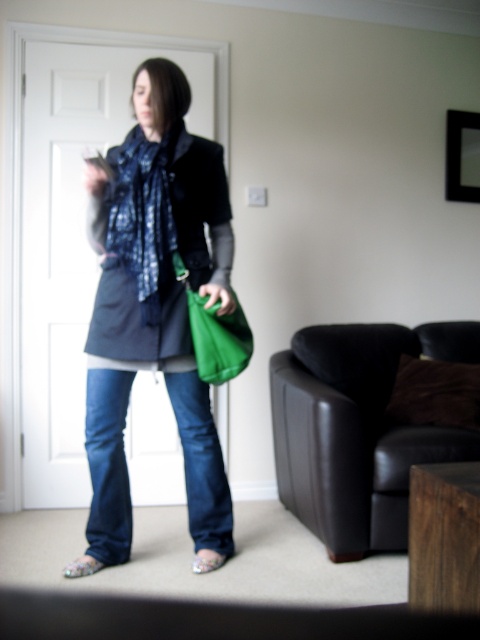
Is green leather bag at lower center positioned in front of floral fabric sandal at lower left?

Yes, green leather bag at lower center is in front of floral fabric sandal at lower left.

The image size is (480, 640). What are the coordinates of `green leather bag at lower center` in the screenshot? It's located at (216, 333).

Does matte black jacket at center appear under green leather bag at lower center?

Result: Indeed, matte black jacket at center is positioned under green leather bag at lower center.

From the picture: Does matte black jacket at center appear on the left side of green leather bag at lower center?

Indeed, matte black jacket at center is positioned on the left side of green leather bag at lower center.

This screenshot has width=480, height=640. Describe the element at coordinates (156, 305) in the screenshot. I see `matte black jacket at center` at that location.

Where is `matte black jacket at center`? This screenshot has height=640, width=480. matte black jacket at center is located at coordinates (156, 305).

Can you confirm if black leather armchair at center right is bigger than floral fabric sandal at lower center?

Yes, black leather armchair at center right is bigger than floral fabric sandal at lower center.

Who is more distant from viewer, (348, 557) or (193, 564)?

Positioned behind is point (348, 557).

Describe the element at coordinates (358, 428) in the screenshot. I see `black leather armchair at center right` at that location.

Find the location of a particular element. This screenshot has width=480, height=640. black leather armchair at center right is located at coordinates (358, 428).